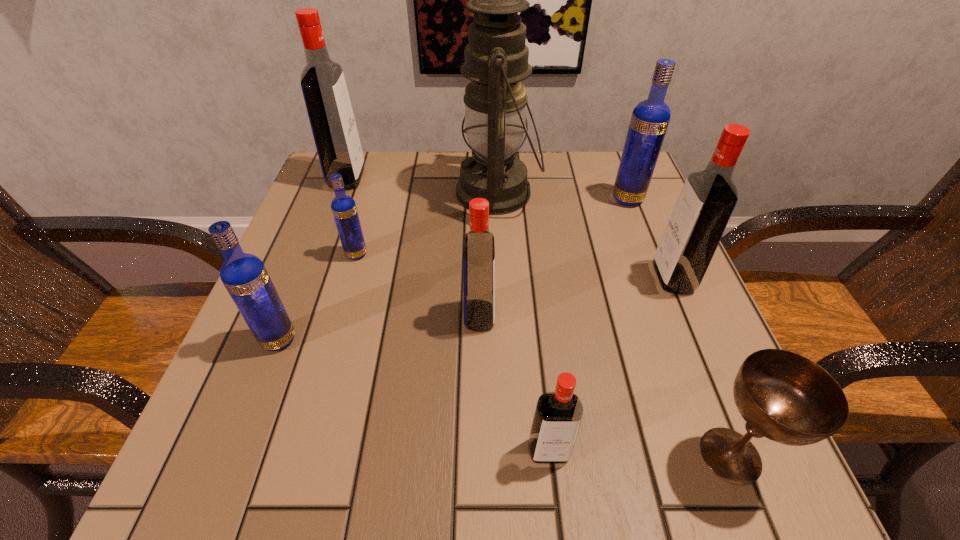
Identify the location of the second red vodka from left to right. The height and width of the screenshot is (540, 960). (479, 248).

This screenshot has width=960, height=540. Find the location of `the smallest blue vodka`. the smallest blue vodka is located at coordinates tap(344, 209).

Where is `the second nearest blue vodka`? The width and height of the screenshot is (960, 540). the second nearest blue vodka is located at coordinates [344, 209].

Find the location of a particular element. The image size is (960, 540). the second red vodka from right to left is located at coordinates (558, 415).

What are the coordinates of `the nearest red vodka` in the screenshot? It's located at (558, 415).

The height and width of the screenshot is (540, 960). What are the coordinates of `chalice` in the screenshot? It's located at (783, 396).

What are the coordinates of `free space located on the right of the oil lamp` in the screenshot? It's located at (561, 192).

Find the location of a particular element. Image resolution: width=960 pixels, height=540 pixels. vacant space located 0.090m on the front and back of the leftmost red vodka is located at coordinates (401, 179).

The height and width of the screenshot is (540, 960). Identify the location of vacant space located 0.340m on the left of the rightmost blue vodka. (462, 199).

Locate an element on the screen. free location located 0.220m on the front and back of the rightmost red vodka is located at coordinates (538, 278).